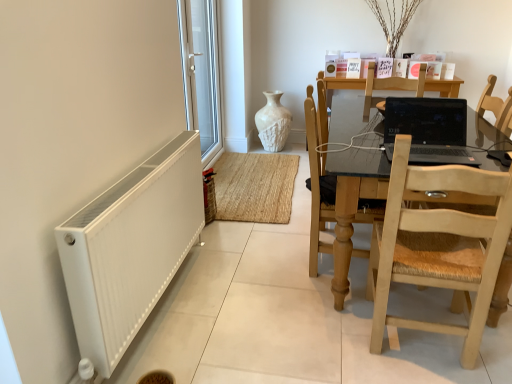
You are a GUI agent. You are given a task and a screenshot of the screen. Output one action in this format:
    pyautogui.click(x=<x>, y=<y>)
    Task: Click on the free space behind white matte radiator at lower left
    The width and height of the screenshot is (512, 384).
    Given the screenshot: What is the action you would take?
    pyautogui.click(x=240, y=245)